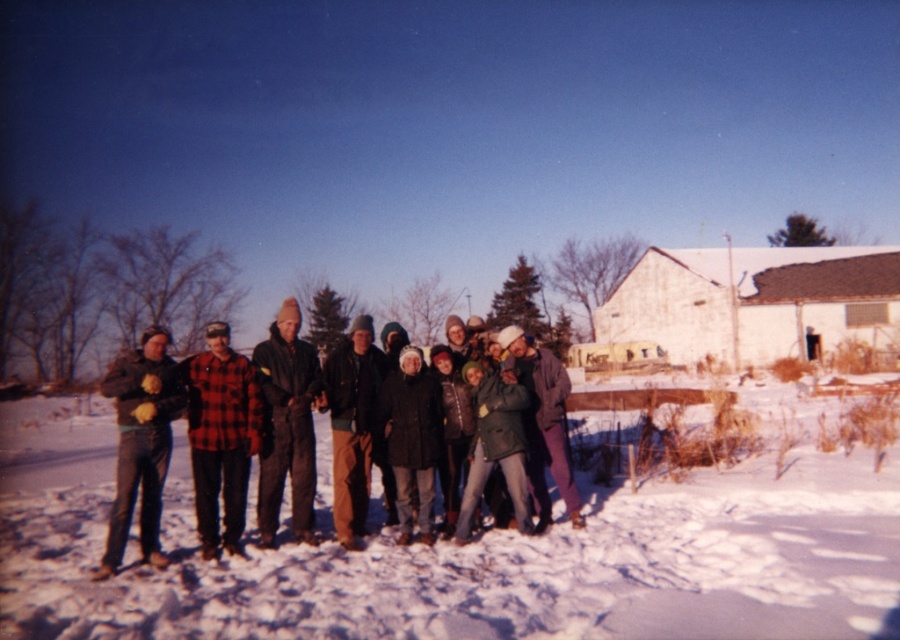
Does point (267, 488) come closer to viewer compared to point (532, 426)?

Yes, it is in front of point (532, 426).

Is flannel shirt at center thinner than matte gray jacket at center?

Correct, flannel shirt at center's width is less than matte gray jacket at center's.

Where is `flannel shirt at center`? flannel shirt at center is located at coordinates [x=286, y=424].

Does plaid flannel shirt at center have a smaller size compared to dark gray wool coat at center?

Incorrect, plaid flannel shirt at center is not smaller in size than dark gray wool coat at center.

Measure the distance between plaid flannel shirt at center and camera.

plaid flannel shirt at center is 21.97 feet from camera.

At what (x,y) coordinates should I click in order to perform the action: click on plaid flannel shirt at center. Please return your answer as a coordinate pair (x, y). This screenshot has width=900, height=640. Looking at the image, I should click on (216, 433).

Which of these two, dark gray woolen jacket at left or brown woolen hat at center, stands taller?

dark gray woolen jacket at left is taller.

Between dark gray woolen jacket at left and brown woolen hat at center, which one has less height?

brown woolen hat at center is shorter.

Is point (123, 522) positioned behind point (362, 328)?

No, (123, 522) is closer to viewer.

You are a GUI agent. You are given a task and a screenshot of the screen. Output one action in this format:
    pyautogui.click(x=<x>, y=<y>)
    Task: Click on the dark gray woolen jacket at left
    The height and width of the screenshot is (640, 900).
    Given the screenshot: What is the action you would take?
    pyautogui.click(x=140, y=442)